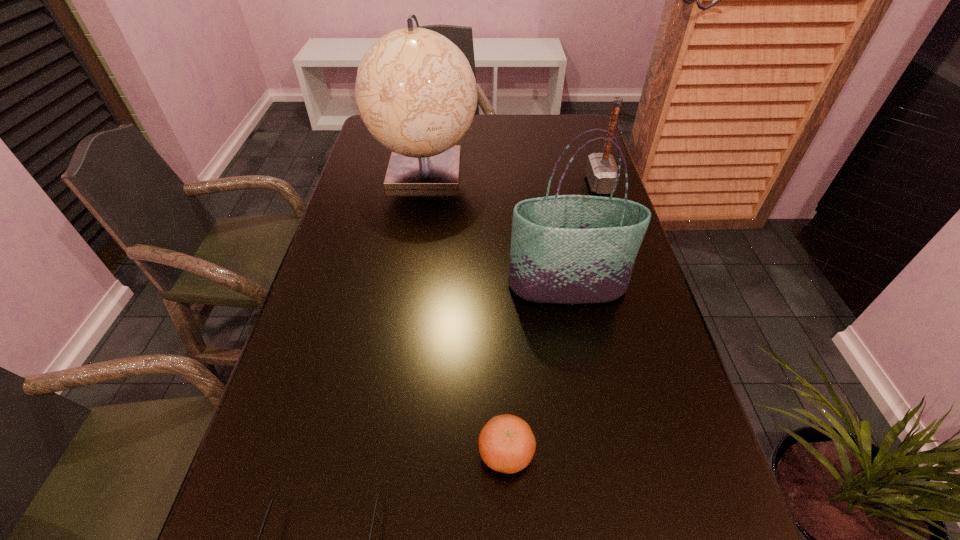
The width and height of the screenshot is (960, 540). Find the location of `globe`. globe is located at coordinates (415, 91).

At what (x,y) coordinates should I click in order to perform the action: click on the third farthest object. Please return your answer as a coordinate pair (x, y). The image size is (960, 540). Looking at the image, I should click on (566, 249).

This screenshot has height=540, width=960. What are the coordinates of `the third tallest object` in the screenshot? It's located at (601, 170).

Where is `the fourth tallest object`? the fourth tallest object is located at coordinates (507, 444).

Where is `the second nearest object`? This screenshot has height=540, width=960. the second nearest object is located at coordinates (507, 444).

Identify the location of free space located 0.250m on the surface of the globe showing Europe and Africa. (410, 261).

The image size is (960, 540). I want to click on vacant space located 0.300m on the front of the third nearest object, so [x=594, y=434].

This screenshot has height=540, width=960. In order to click on free space located 0.090m on the striking surface of the hammer in this screenshot , I will do `click(558, 184)`.

Where is `vacant space located on the striking surface of the hammer`? vacant space located on the striking surface of the hammer is located at coordinates (511, 184).

What are the coordinates of `vacant space situated on the striking surface of the hammer` in the screenshot? It's located at (524, 184).